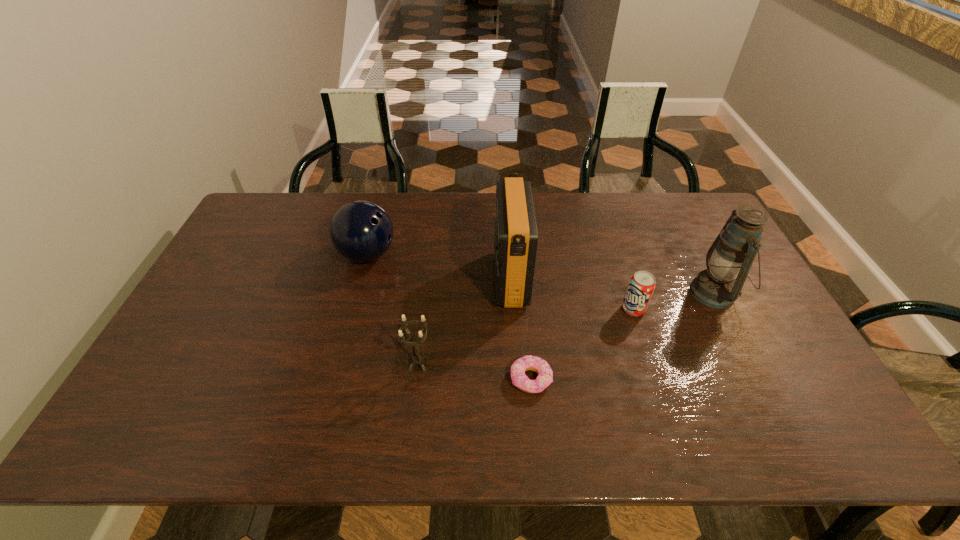
Locate an element on the screen. This screenshot has width=960, height=540. vacant space located on the front-facing side of the radio receiver is located at coordinates (477, 279).

Locate an element on the screen. The image size is (960, 540). vacant region located on the front-facing side of the radio receiver is located at coordinates (412, 279).

Where is `vacant region located on the surface of the leftmost object near the finger holes`? Image resolution: width=960 pixels, height=540 pixels. vacant region located on the surface of the leftmost object near the finger holes is located at coordinates (416, 255).

Where is `vacant position located 0.190m on the right of the second object from left to right`? The width and height of the screenshot is (960, 540). vacant position located 0.190m on the right of the second object from left to right is located at coordinates (506, 364).

What are the coordinates of `vacant area located on the front of the soda can` in the screenshot? It's located at pyautogui.click(x=663, y=403).

At what (x,y) coordinates should I click in order to perform the action: click on vacant space located on the right of the shortest object. Please return your answer as a coordinate pair (x, y). Looking at the image, I should click on (596, 379).

Locate an element on the screen. The height and width of the screenshot is (540, 960). object present at the right edge is located at coordinates (730, 257).

Where is `vacant space at the far edge`? This screenshot has height=540, width=960. vacant space at the far edge is located at coordinates (457, 198).

In the image, there is a desktop. Where is `vacant area at the near edge`? The width and height of the screenshot is (960, 540). vacant area at the near edge is located at coordinates (412, 426).

Locate an element on the screen. This screenshot has height=540, width=960. vacant space at the far left corner of the desktop is located at coordinates (296, 201).